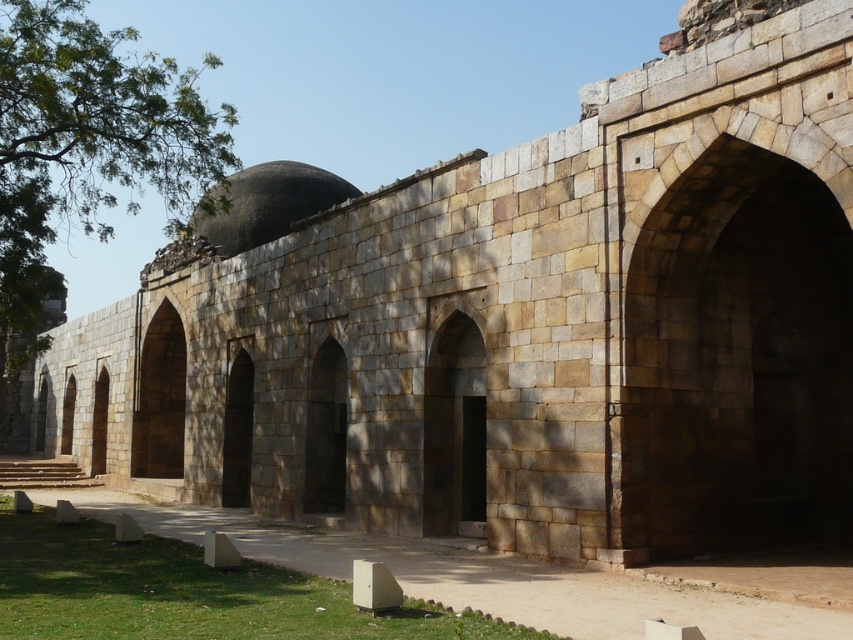
You are an architect examining the ancient stone structure. You need to determine the spatial relationship between the brown stone arch at right and the dark gray stone dome at center. Which object is located to the right of the other?

The brown stone arch at right is positioned on the right side of the dark gray stone dome at center.

You are an architect examining the ancient stone structure. You need to determine which object has a greater height between the brown stone arch at right and the dark gray stone dome at center. Based on the scene, which one is taller?

The brown stone arch at right has a greater height compared to the dark gray stone dome at center, so the brown stone arch at right is taller.